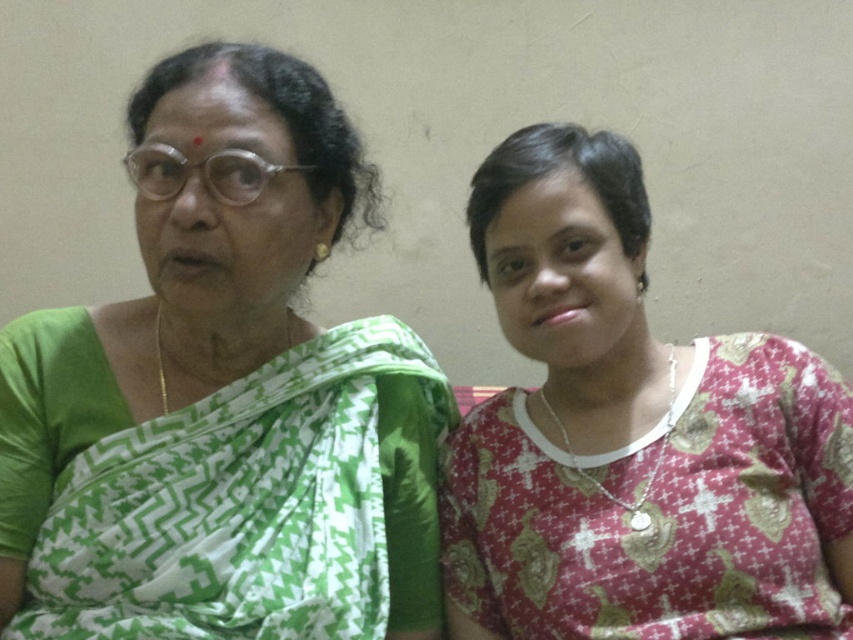
Question: Which object is closer to the camera taking this photo?

Choices:
 (A) green woven saree at left
 (B) pink printed blouse at right

Answer: (A)

Question: Which point is closer to the camera?

Choices:
 (A) pyautogui.click(x=318, y=390)
 (B) pyautogui.click(x=642, y=362)

Answer: (A)

Question: Which object appears farthest from the camera in this image?

Choices:
 (A) green woven saree at left
 (B) pink printed blouse at right

Answer: (B)

Question: Is green woven saree at left above pink printed blouse at right?

Choices:
 (A) no
 (B) yes

Answer: (B)

Question: From the image, what is the correct spatial relationship of green woven saree at left in relation to pink printed blouse at right?

Choices:
 (A) right
 (B) left

Answer: (B)

Question: Can you confirm if green woven saree at left is positioned to the left of pink printed blouse at right?

Choices:
 (A) yes
 (B) no

Answer: (A)